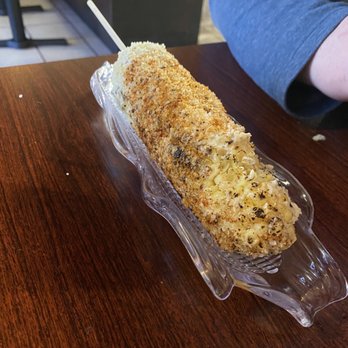
The height and width of the screenshot is (348, 348). Find the location of `crumb on center right side`. crumb on center right side is located at coordinates (322, 143).